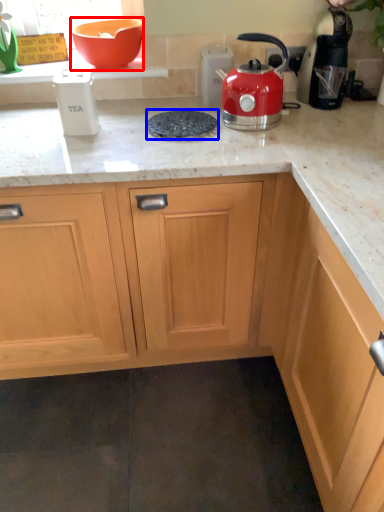
Question: Among these objects, which one is nearest to the camera, bowl (highlighted by a red box) or gas stove (highlighted by a blue box)?

Choices:
 (A) bowl
 (B) gas stove

Answer: (B)